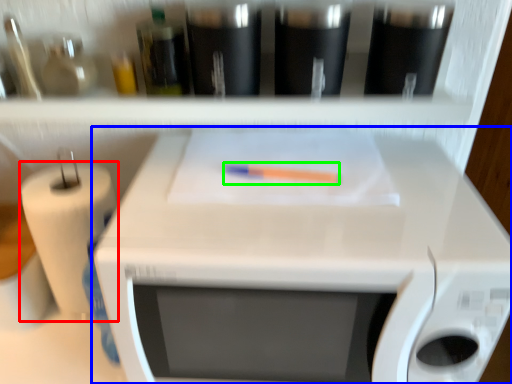
Question: Which is farther away from paper towel (highlighted by a red box)? appliance (highlighted by a blue box) or crayon (highlighted by a green box)?

Choices:
 (A) appliance
 (B) crayon

Answer: (B)